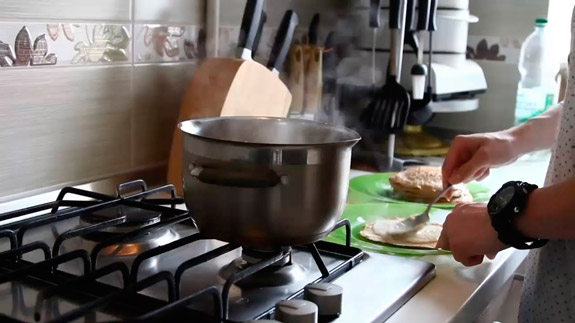
Locate an element on the screen. kitchen tile is located at coordinates (75, 138), (149, 99), (154, 14), (103, 15).